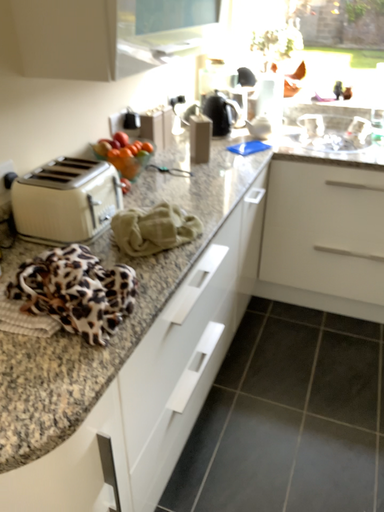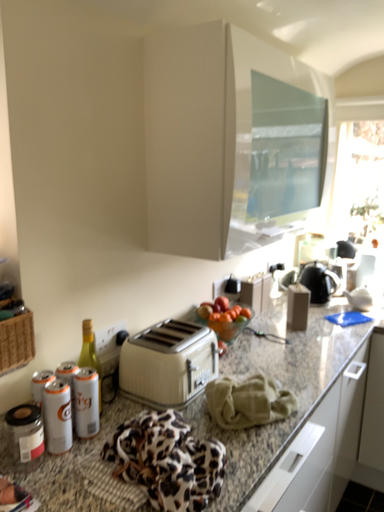
Question: Which way did the camera rotate in the video?

Choices:
 (A) rotated right
 (B) rotated left

Answer: (B)